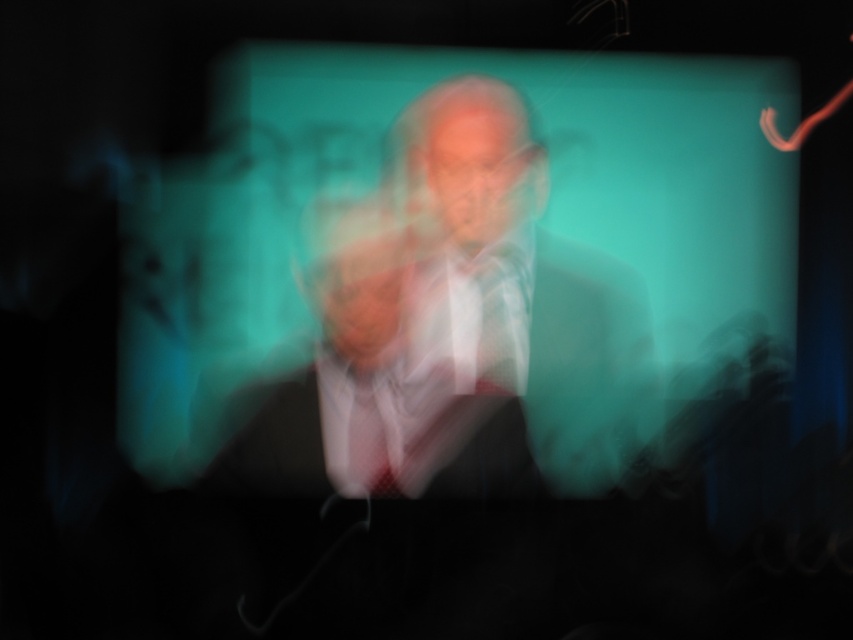
Is translucent glass screen at center shorter than matte black suit at center?

Incorrect, translucent glass screen at center's height does not fall short of matte black suit at center's.

Between point (677, 204) and point (491, 360), which one is positioned in front?

Point (677, 204) is more forward.

At what (x,y) coordinates should I click in order to perform the action: click on translucent glass screen at center. Please return your answer as a coordinate pair (x, y). The height and width of the screenshot is (640, 853). Looking at the image, I should click on (531, 244).

Consider the image. Does smooth black suit at center have a lesser width compared to checkered fabric tie at center?

Incorrect, smooth black suit at center's width is not less than checkered fabric tie at center's.

Is point (506, 470) in front of point (357, 396)?

No, it is not.

Between point (367, 449) and point (372, 413), which one is positioned behind?

The point (372, 413) is behind.

Locate an element on the screen. smooth black suit at center is located at coordinates (408, 392).

Which is more to the left, matte black suit at center or smooth black suit at center?

smooth black suit at center is more to the left.

Who is taller, matte black suit at center or smooth black suit at center?

matte black suit at center is taller.

Find the location of a particular element. The width and height of the screenshot is (853, 640). matte black suit at center is located at coordinates (471, 273).